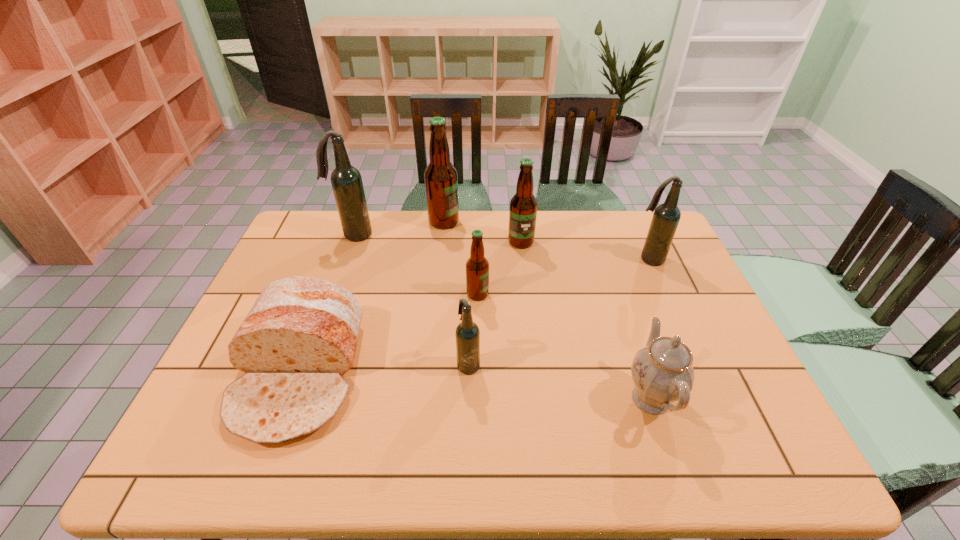
At what (x,y) coordinates should I click in order to perform the action: click on empty space between the fourth farthest beer bottle and the second nearest brown beer bottle. Please return your answer as a coordinate pair (x, y). The width and height of the screenshot is (960, 540). Looking at the image, I should click on (585, 251).

Identify the location of vacant region between the bread and the seventh object from left to right. The width and height of the screenshot is (960, 540). (474, 386).

Identify the location of free spot between the leftmost dark beer bottle and the fifth beer bottle from left to right. (438, 238).

Where is `vacant area that lies between the nearest brown beer bottle and the third object from left to right`? The height and width of the screenshot is (540, 960). vacant area that lies between the nearest brown beer bottle and the third object from left to right is located at coordinates (461, 258).

Image resolution: width=960 pixels, height=540 pixels. I want to click on empty location between the fifth beer bottle from left to right and the smallest brown beer bottle, so click(x=499, y=268).

Find the location of `vacant region between the leftmost brown beer bottle and the chinaware`. vacant region between the leftmost brown beer bottle and the chinaware is located at coordinates (547, 310).

Find the location of `the second closest object relative to the smallest dark beer bottle`. the second closest object relative to the smallest dark beer bottle is located at coordinates (299, 338).

Locate which object is the third closest to the second dark beer bottle from right to left. Please provide its 2D coordinates. Your answer should be formatted as a tuple, i.e. [(x, y)], where the tuple contains the x and y coordinates of a point satisfying the conditions above.

[(662, 372)]

This screenshot has height=540, width=960. What are the coordinates of `the second closest beer bottle to the leftmost beer bottle` in the screenshot? It's located at (477, 266).

At what (x,y) coordinates should I click in order to perform the action: click on beer bottle identified as the second closest to the second farthest brown beer bottle. Please return your answer as a coordinate pair (x, y). The width and height of the screenshot is (960, 540). Looking at the image, I should click on (477, 266).